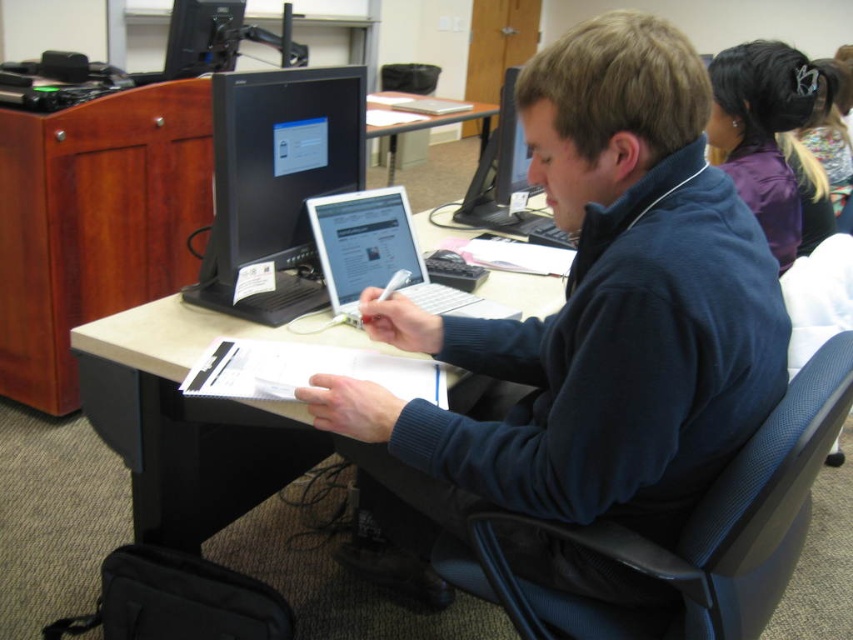
Question: Can you confirm if blue fleece jacket at center is positioned below black glossy monitor at center?

Choices:
 (A) no
 (B) yes

Answer: (B)

Question: Which point is farther to the camera?

Choices:
 (A) blue fleece jacket at center
 (B) beige wood table at center
 (C) black glossy monitor at center
 (D) white glossy laptop at center

Answer: (D)

Question: Which point appears farthest from the camera in this image?

Choices:
 (A) (155, 481)
 (B) (325, 84)
 (C) (376, 236)

Answer: (C)

Question: Can you confirm if beige wood table at center is positioned above purple fabric hair tie at upper right?

Choices:
 (A) no
 (B) yes

Answer: (A)

Question: Does beige wood table at center have a smaller size compared to black glossy monitor at center?

Choices:
 (A) yes
 (B) no

Answer: (B)

Question: Which object is the closest to the blue fleece jacket at center?

Choices:
 (A) black glossy monitor at center
 (B) purple fabric hair tie at upper right
 (C) light brown wooden table at center

Answer: (A)